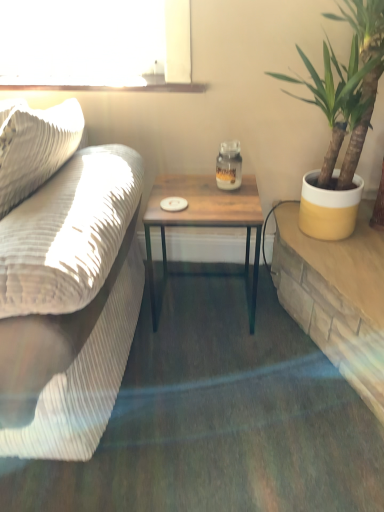
I want to click on free spot in front of matte glass jar at center, so click(x=223, y=203).